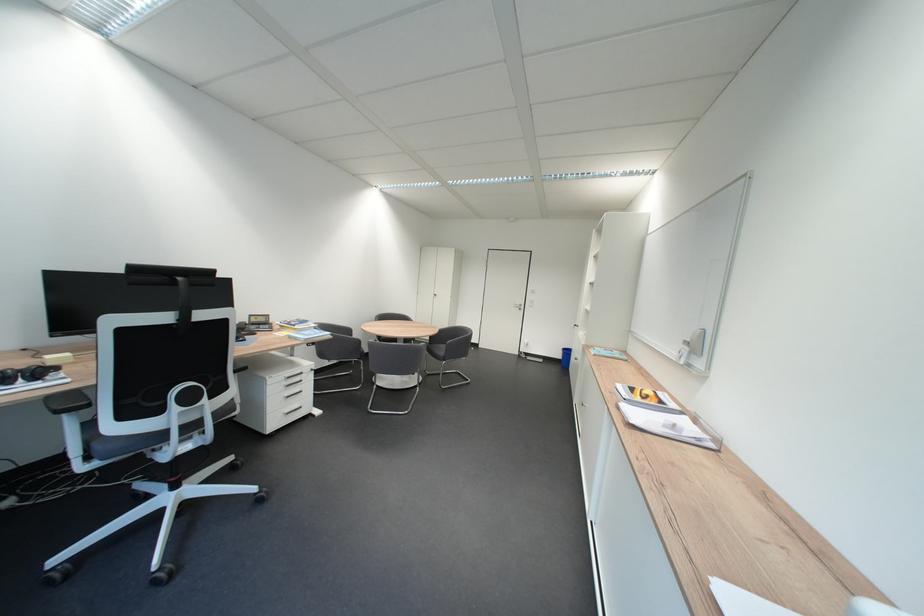
I want to click on silver door handle, so click(517, 305).